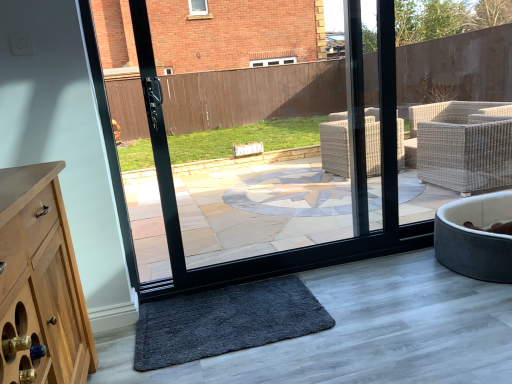
Measure the distance between point (300, 319) and camera.

Point (300, 319) is 1.99 meters away from camera.

What do you see at coordinates (225, 321) in the screenshot?
I see `dark gray shaggy mat at lower center` at bounding box center [225, 321].

This screenshot has height=384, width=512. Identify the location of dark gray shaggy mat at lower center. (225, 321).

Measure the distance between velvet grey pet bed at lower right and camera.

They are 6.85 feet apart.

Image resolution: width=512 pixels, height=384 pixels. What do you see at coordinates (475, 237) in the screenshot? I see `velvet grey pet bed at lower right` at bounding box center [475, 237].

Where is `velvet grey pet bed at lower right`? This screenshot has width=512, height=384. velvet grey pet bed at lower right is located at coordinates (475, 237).

I want to click on dark gray shaggy mat at lower center, so click(x=225, y=321).

Considering the relative positions of velvet grey pet bed at lower right and dark gray shaggy mat at lower center in the image provided, is velvet grey pet bed at lower right to the right of dark gray shaggy mat at lower center from the viewer's perspective?

Yes.

Is the depth of velvet grey pet bed at lower right greater than that of dark gray shaggy mat at lower center?

Yes, the depth of velvet grey pet bed at lower right is greater than that of dark gray shaggy mat at lower center.

Is point (476, 225) closer or farther from the camera than point (276, 279)?

Point (476, 225).

From the image's perspective, does velvet grey pet bed at lower right appear higher than dark gray shaggy mat at lower center?

Yes, from the image's perspective, velvet grey pet bed at lower right is on top of dark gray shaggy mat at lower center.

From a real-world perspective, who is located lower, velvet grey pet bed at lower right or dark gray shaggy mat at lower center?

dark gray shaggy mat at lower center.

Can you confirm if velvet grey pet bed at lower right is thinner than dark gray shaggy mat at lower center?

No.

Which of these two, velvet grey pet bed at lower right or dark gray shaggy mat at lower center, stands shorter?

Standing shorter between the two is dark gray shaggy mat at lower center.

Is velvet grey pet bed at lower right smaller than dark gray shaggy mat at lower center?

No.

Is velvet grey pet bed at lower right not within dark gray shaggy mat at lower center?

Indeed, velvet grey pet bed at lower right is completely outside dark gray shaggy mat at lower center.

Is velvet grey pet bed at lower right next to dark gray shaggy mat at lower center and touching it?

velvet grey pet bed at lower right and dark gray shaggy mat at lower center are clearly separated.

Is velvet grey pet bed at lower right facing away from dark gray shaggy mat at lower center?

No.

What's the angular difference between velvet grey pet bed at lower right and dark gray shaggy mat at lower center's facing directions?

velvet grey pet bed at lower right and dark gray shaggy mat at lower center are facing 4.17 degrees away from each other.

Locate an element on the screen. This screenshot has height=384, width=512. mat on the left of velvet grey pet bed at lower right is located at coordinates (225, 321).

Is dark gray shaggy mat at lower center to the left of velvet grey pet bed at lower right from the viewer's perspective?

Yes, dark gray shaggy mat at lower center is to the left of velvet grey pet bed at lower right.

Is dark gray shaggy mat at lower center further to the viewer compared to velvet grey pet bed at lower right?

No.

Does point (267, 327) come in front of point (479, 205)?

Yes, point (267, 327) is closer to viewer.

From the image's perspective, between dark gray shaggy mat at lower center and velvet grey pet bed at lower right, which one is located above?

velvet grey pet bed at lower right.

From a real-world perspective, which is physically above, dark gray shaggy mat at lower center or velvet grey pet bed at lower right?

From a 3D spatial view, velvet grey pet bed at lower right is above.

From the picture: Which of these two, dark gray shaggy mat at lower center or velvet grey pet bed at lower right, is wider?

velvet grey pet bed at lower right.

Considering the sizes of dark gray shaggy mat at lower center and velvet grey pet bed at lower right in the image, is dark gray shaggy mat at lower center taller or shorter than velvet grey pet bed at lower right?

dark gray shaggy mat at lower center is shorter than velvet grey pet bed at lower right.

Considering the sizes of objects dark gray shaggy mat at lower center and velvet grey pet bed at lower right in the image provided, who is smaller, dark gray shaggy mat at lower center or velvet grey pet bed at lower right?

Smaller between the two is dark gray shaggy mat at lower center.

Would you say dark gray shaggy mat at lower center is outside velvet grey pet bed at lower right?

Yes, dark gray shaggy mat at lower center is not within velvet grey pet bed at lower right.

Is dark gray shaggy mat at lower center beside velvet grey pet bed at lower right?

No, dark gray shaggy mat at lower center is not beside velvet grey pet bed at lower right.

Could you tell me if dark gray shaggy mat at lower center is facing velvet grey pet bed at lower right?

No, dark gray shaggy mat at lower center is not aimed at velvet grey pet bed at lower right.

Can you tell me how much dark gray shaggy mat at lower center and velvet grey pet bed at lower right differ in facing direction?

dark gray shaggy mat at lower center and velvet grey pet bed at lower right are facing 4.17 degrees away from each other.

How distant is dark gray shaggy mat at lower center from velvet grey pet bed at lower right?

dark gray shaggy mat at lower center is 3.91 feet from velvet grey pet bed at lower right.

The image size is (512, 384). Find the location of `mat below the velvet grey pet bed at lower right (from the image's perspective)`. mat below the velvet grey pet bed at lower right (from the image's perspective) is located at coordinates (225, 321).

Locate an element on the screen. The image size is (512, 384). bath above the dark gray shaggy mat at lower center (from the image's perspective) is located at coordinates (475, 237).

The height and width of the screenshot is (384, 512). I want to click on bath behind the dark gray shaggy mat at lower center, so click(475, 237).